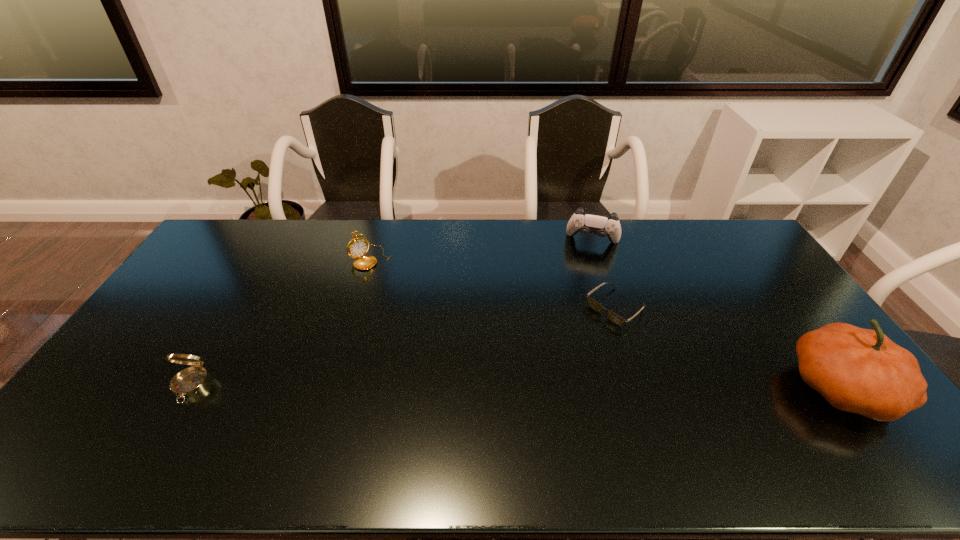
Locate an element on the screen. This screenshot has height=540, width=960. vacant space that satisfies the following two spatial constraints: 1. on the back side of the second object from left to right; 2. on the right side of the control is located at coordinates (375, 241).

I want to click on free location that satisfies the following two spatial constraints: 1. with the dial facing the tallest object; 2. on the front face of the compass, so click(190, 387).

This screenshot has height=540, width=960. I want to click on vacant area in the image that satisfies the following two spatial constraints: 1. on the front side of the pumpkin; 2. on the front face of the control, so click(639, 387).

Locate an element on the screen. Image resolution: width=960 pixels, height=540 pixels. blank space that satisfies the following two spatial constraints: 1. with the dial facing the leftmost object; 2. on the front face of the pumpkin is located at coordinates (190, 387).